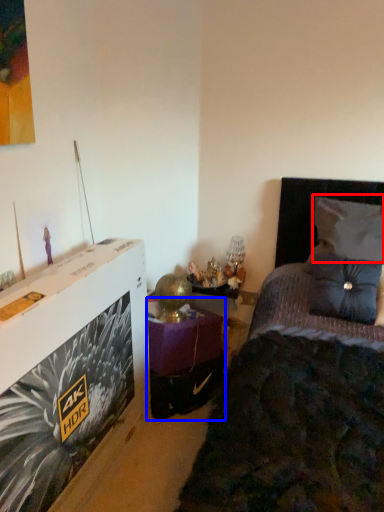
Question: Which object appears closest to the camera in this image, pillow (highlighted by a red box) or table (highlighted by a blue box)?

Choices:
 (A) pillow
 (B) table

Answer: (A)